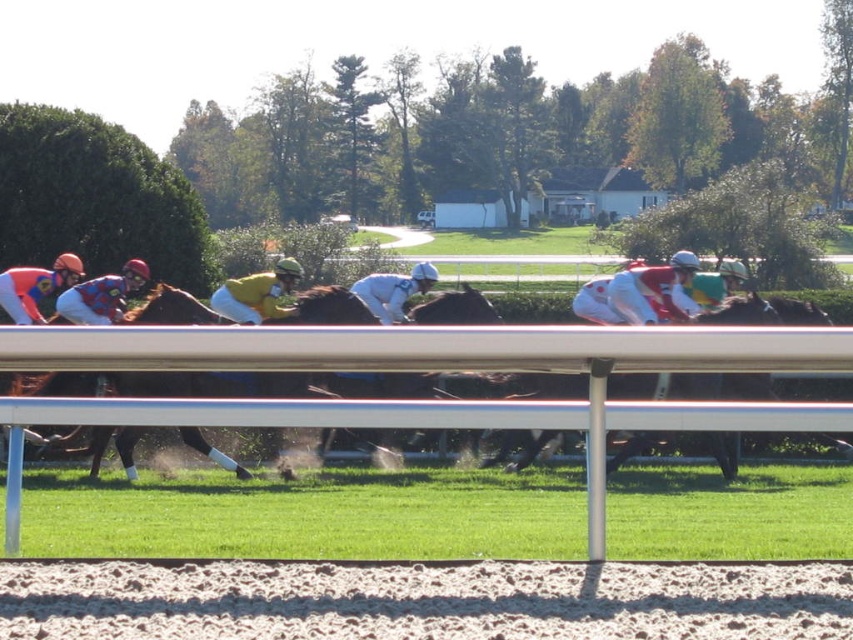
This screenshot has height=640, width=853. What do you see at coordinates (422, 602) in the screenshot?
I see `brown textured dirt track at lower center` at bounding box center [422, 602].

Is brown textured dirt track at lower center shorter than white matte jockey at center?

Yes, brown textured dirt track at lower center is shorter than white matte jockey at center.

Describe the element at coordinates (422, 602) in the screenshot. I see `brown textured dirt track at lower center` at that location.

Where is `brown textured dirt track at lower center`? The image size is (853, 640). brown textured dirt track at lower center is located at coordinates (422, 602).

Is brown glossy horse at center taller than white matte jockey at center?

Indeed, brown glossy horse at center has a greater height compared to white matte jockey at center.

Between point (184, 385) and point (401, 317), which one is positioned behind?

Positioned behind is point (401, 317).

Does point (543, 332) lie in front of point (434, 273)?

Yes.

This screenshot has height=640, width=853. I want to click on brown glossy horse at center, so click(318, 356).

Does matte orange helmet at left have a larger size compared to white matte jockey at center?

No.

Between matte orange helmet at left and white matte jockey at center, which one appears on the right side from the viewer's perspective?

white matte jockey at center

Find the location of a particular element. matte orange helmet at left is located at coordinates (35, 285).